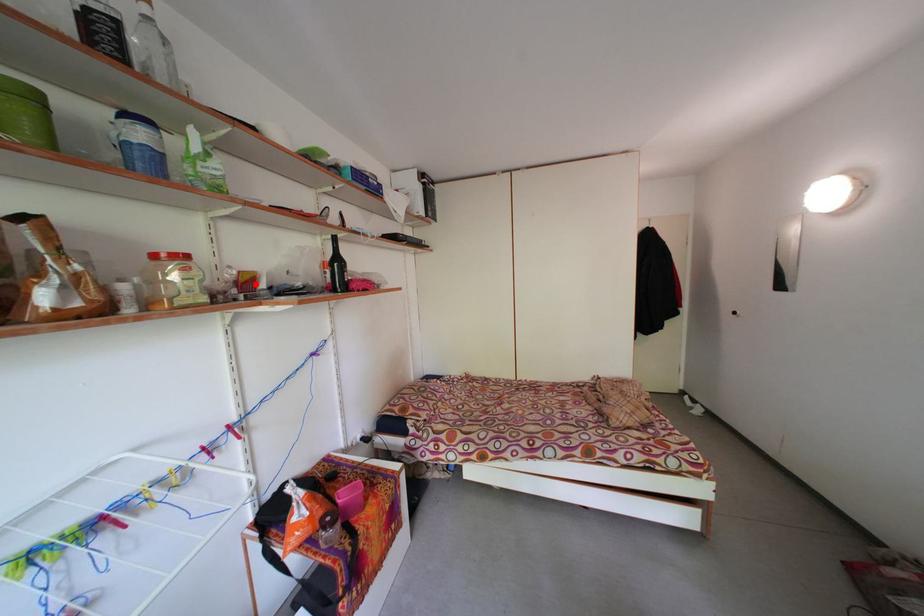
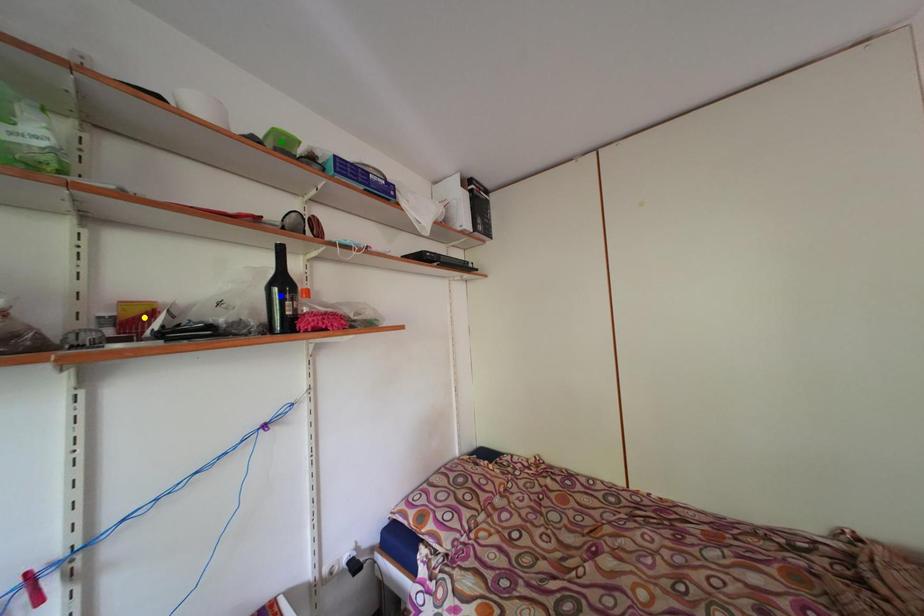
Question: I am providing you with two images of the same scene from different viewpoints. A red point is marked on the first image. You are given multiple points on the second image. Can you choose the point in image 2 that corresponds to the point in image 1?

Choices:
 (A) green point
 (B) blue point
 (C) yellow point

Answer: (C)